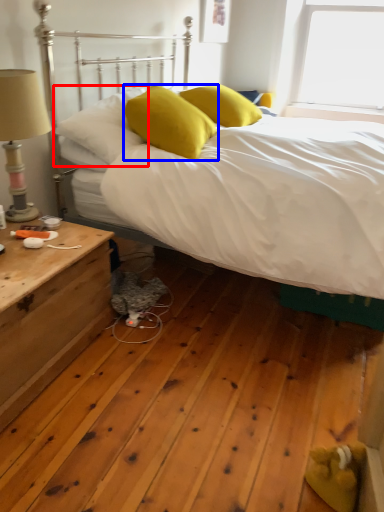
Question: Among these objects, which one is nearest to the camera, pillow (highlighted by a red box) or pillow (highlighted by a blue box)?

Choices:
 (A) pillow
 (B) pillow

Answer: (B)